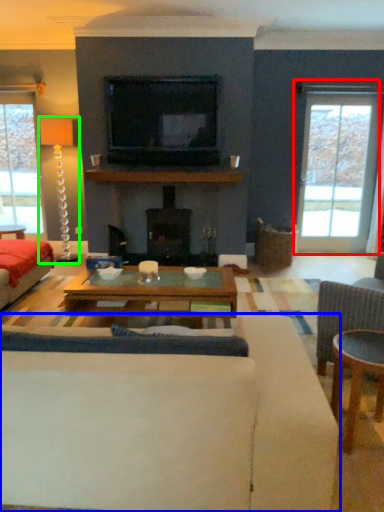
Question: Which is farther away from window (highlighted by a red box)? studio couch (highlighted by a blue box) or lamp (highlighted by a green box)?

Choices:
 (A) studio couch
 (B) lamp

Answer: (A)